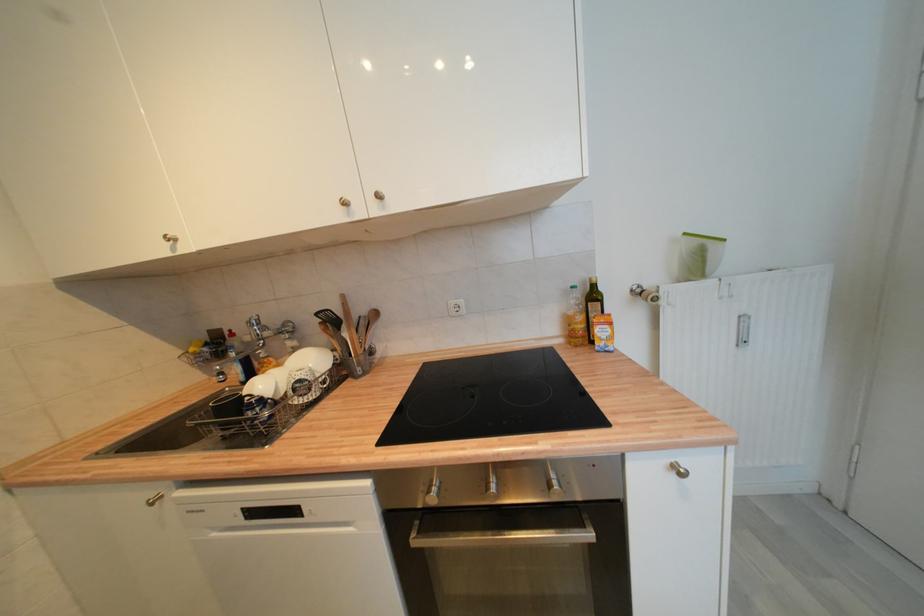
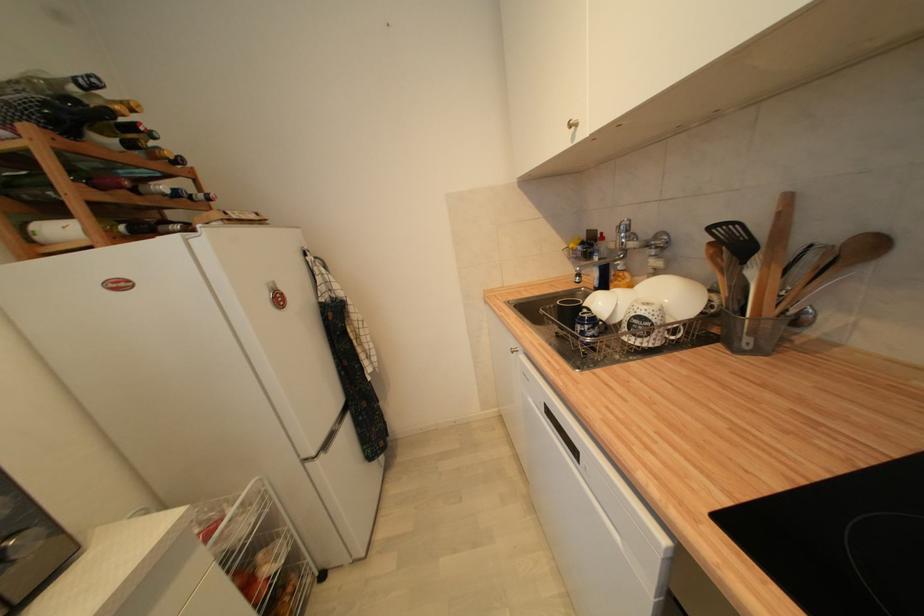
Where in the second image is the point corresponding to point 322,315 from the first image?

(715, 230)